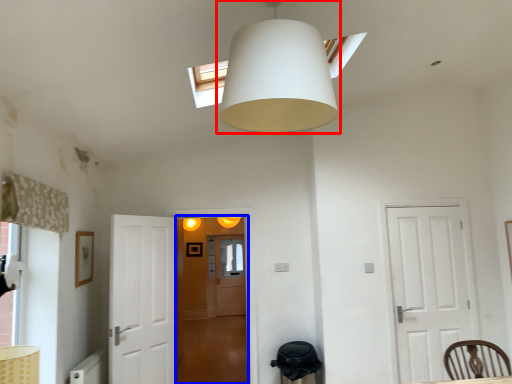
Question: Which of the following is the farthest to the observer, lamp (highlighted by a red box) or glass door (highlighted by a blue box)?

Choices:
 (A) lamp
 (B) glass door

Answer: (B)